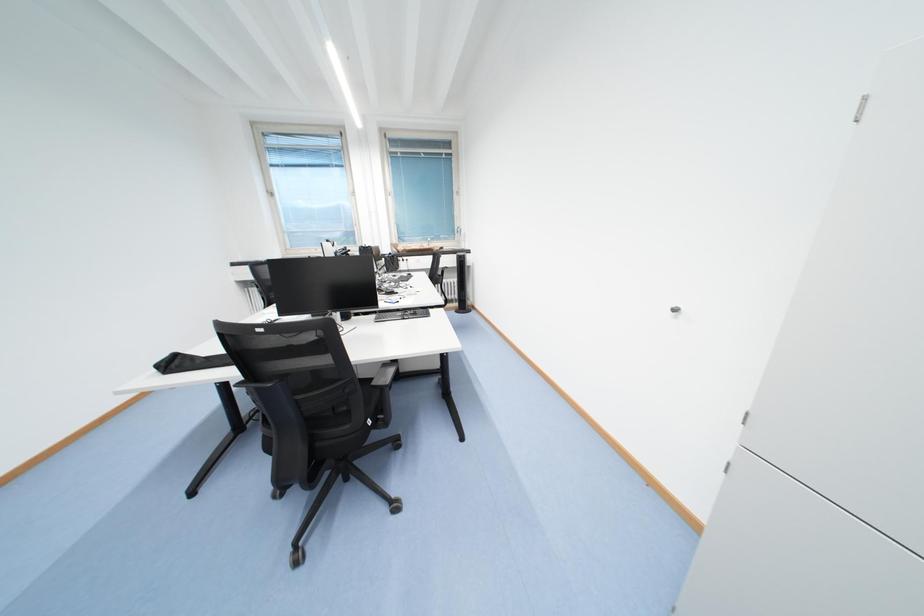
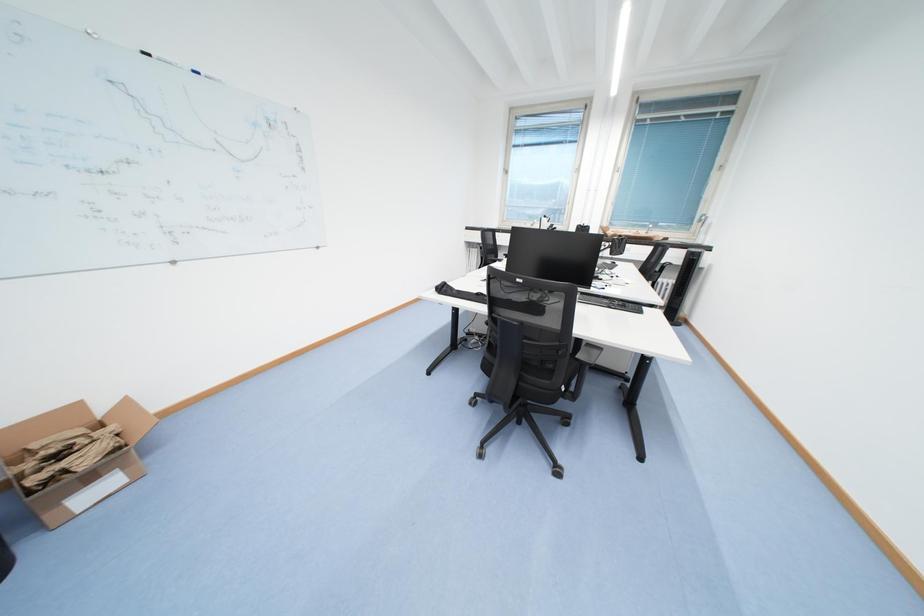
Question: The camera is either moving clockwise (left) or counter-clockwise (right) around the object. The first image is from the beginning of the video and the second image is from the end. Is the camera moving left or right when shooting the video?

Choices:
 (A) Left
 (B) Right

Answer: (B)